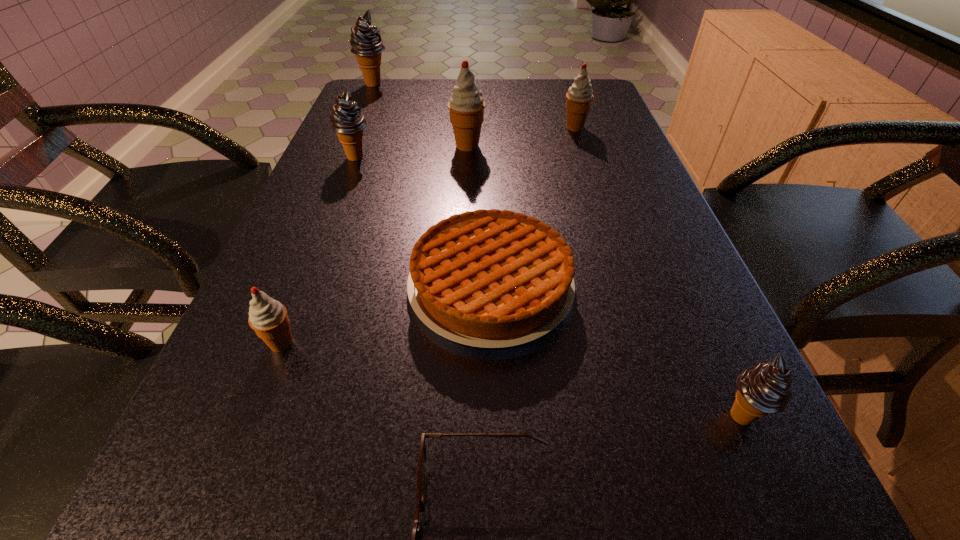
The image size is (960, 540). Find the location of `the farthest icecream`. the farthest icecream is located at coordinates (366, 42).

Locate an element on the screen. The width and height of the screenshot is (960, 540). the farthest object is located at coordinates (366, 42).

This screenshot has width=960, height=540. I want to click on the second red icecream from right to left, so click(466, 105).

I want to click on the second nearest red icecream, so [466, 105].

Identify the location of the second farthest icecream. This screenshot has width=960, height=540. (579, 97).

Image resolution: width=960 pixels, height=540 pixels. Find the location of `the second smallest red icecream`. the second smallest red icecream is located at coordinates (579, 97).

Where is `the second farthest chocolate icecream`? This screenshot has width=960, height=540. the second farthest chocolate icecream is located at coordinates (348, 122).

The image size is (960, 540). Identify the location of the smallest red icecream. (268, 318).

This screenshot has width=960, height=540. What are the coordinates of `the nearest red icecream` in the screenshot? It's located at (268, 318).

Image resolution: width=960 pixels, height=540 pixels. Find the location of `the second nearest object`. the second nearest object is located at coordinates (763, 389).